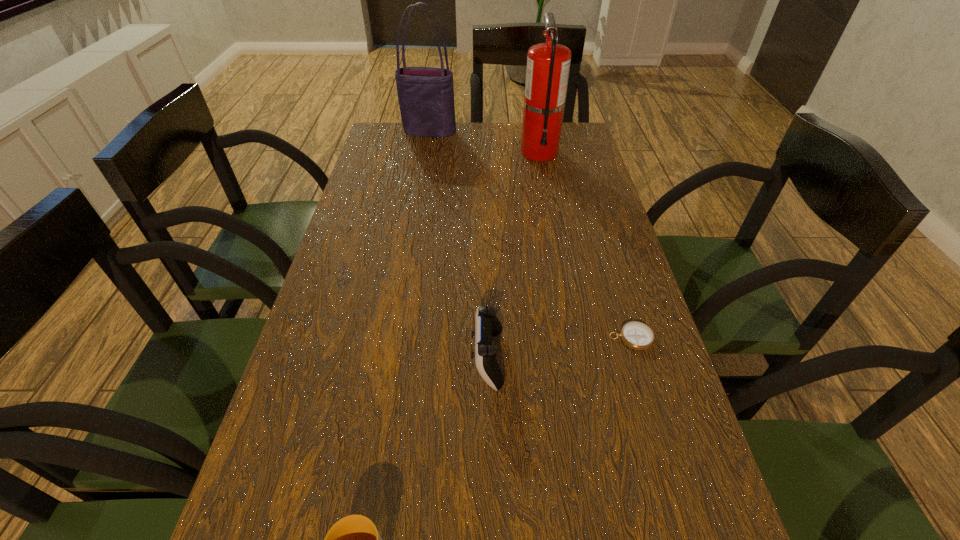
Where is `tote bag`? This screenshot has height=540, width=960. tote bag is located at coordinates (x=426, y=94).

Locate an element on the screen. Image resolution: width=960 pixels, height=540 pixels. fire extinguisher is located at coordinates (548, 64).

Find the location of a particular element. the second object from right to left is located at coordinates (548, 64).

Locate an element on the screen. control is located at coordinates (487, 325).

The height and width of the screenshot is (540, 960). Find the location of `the shortest object`. the shortest object is located at coordinates (636, 335).

At what (x,y) coordinates should I click in order to perform the action: click on compass. Please return your answer as a coordinate pair (x, y). Looking at the image, I should click on (636, 335).

Identify the location of vacant space located 0.300m on the right of the tote bag. This screenshot has height=540, width=960. (540, 132).

Find the location of a particular element. vacant space located at the nozzle of the second object from right to left is located at coordinates (551, 215).

This screenshot has width=960, height=540. I want to click on free space located on the front-facing side of the third object from left to right, so click(x=383, y=359).

Where is `vacant area situated on the front-facing side of the third object from left to right`? vacant area situated on the front-facing side of the third object from left to right is located at coordinates (348, 359).